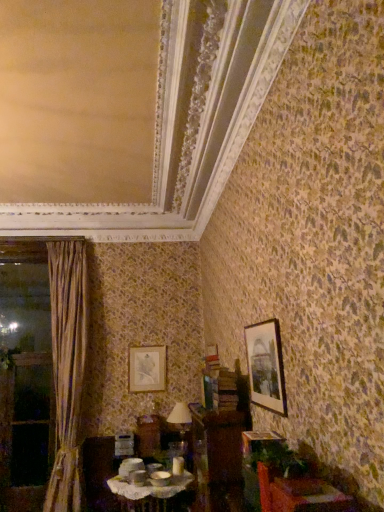
Question: Is matte ceramic bowls at center, which is the first table in left-to-right order, wider than silky beige curtain at left?

Choices:
 (A) yes
 (B) no

Answer: (A)

Question: Could you tell me if matte ceramic bowls at center, which is counted as the 1th table, starting from the back, is facing silky beige curtain at left?

Choices:
 (A) yes
 (B) no

Answer: (B)

Question: Would you say silky beige curtain at left is part of matte ceramic bowls at center, marked as the second table in a right-to-left arrangement,'s contents?

Choices:
 (A) yes
 (B) no

Answer: (B)

Question: Is matte ceramic bowls at center, which is the second table in top-to-bottom order, positioned with its back to silky beige curtain at left?

Choices:
 (A) yes
 (B) no

Answer: (B)

Question: Is matte ceramic bowls at center, which is counted as the 1th table, starting from the back, not near silky beige curtain at left?

Choices:
 (A) yes
 (B) no

Answer: (A)

Question: Is matte ceramic bowls at center, which is the second table in top-to-bottom order, to the left of silky beige curtain at left from the viewer's perspective?

Choices:
 (A) yes
 (B) no

Answer: (B)

Question: Could you tell me if silky beige curtain at left is turned towards matte white lampshade at center?

Choices:
 (A) no
 (B) yes

Answer: (A)

Question: Considering the relative positions of silky beige curtain at left and matte white lampshade at center in the image provided, is silky beige curtain at left to the left of matte white lampshade at center from the viewer's perspective?

Choices:
 (A) no
 (B) yes

Answer: (B)

Question: Is silky beige curtain at left wider than matte white lampshade at center?

Choices:
 (A) yes
 (B) no

Answer: (A)

Question: Is silky beige curtain at left closer to camera compared to matte white lampshade at center?

Choices:
 (A) no
 (B) yes

Answer: (B)

Question: From a real-world perspective, is silky beige curtain at left below matte white lampshade at center?

Choices:
 (A) no
 (B) yes

Answer: (A)

Question: Is silky beige curtain at left oriented away from matte white lampshade at center?

Choices:
 (A) yes
 (B) no

Answer: (B)

Question: Is wooden window frame at left completely or partially outside of brown wooden dresser at center?

Choices:
 (A) no
 (B) yes

Answer: (B)